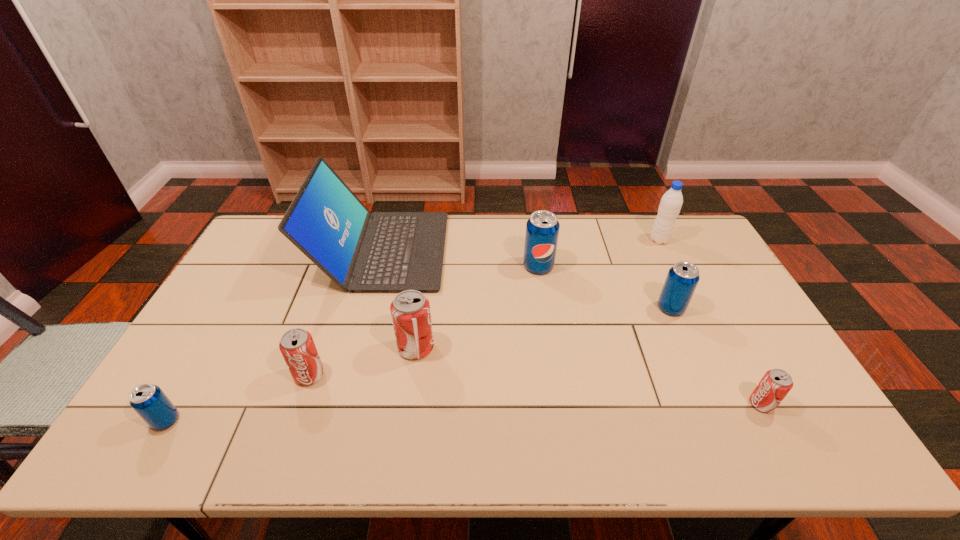
Where is `pink soda can that is the third closest to the leftmost soda can`? The image size is (960, 540). pink soda can that is the third closest to the leftmost soda can is located at coordinates (776, 383).

You are a GUI agent. You are given a task and a screenshot of the screen. Output one action in this format:
    pyautogui.click(x=<x>, y=<y>)
    Task: Click on the third closest pink soda can to the gray laptop computer
    Image resolution: width=960 pixels, height=540 pixels.
    Given the screenshot: What is the action you would take?
    pyautogui.click(x=776, y=383)

At what (x,y) coordinates should I click in order to perform the action: click on free region that satisfies the following two spatial constraints: 1. on the front side of the second smallest pink soda can; 2. on the right side of the nearest pink soda can. Please return your answer as a coordinate pair (x, y). This screenshot has height=540, width=960. Looking at the image, I should click on (300, 404).

You are a GUI agent. You are given a task and a screenshot of the screen. Output one action in this format:
    pyautogui.click(x=<x>, y=<y>)
    Task: Click on the vacant space that satisfies the following two spatial constraints: 1. on the screen of the gray laptop computer; 2. on the right side of the rightmost pink soda can
    The height and width of the screenshot is (540, 960).
    Given the screenshot: What is the action you would take?
    pyautogui.click(x=341, y=404)

This screenshot has width=960, height=540. Identify the location of free space that satisfies the following two spatial constraints: 1. on the back side of the second blue pop soda from right to left; 2. on the right side of the gray water bottle. [x=535, y=240].

Find the location of `free space that satisfies the following two spatial constraints: 1. on the screen of the laptop computer; 2. on the left side of the biggest pink soda can`. free space that satisfies the following two spatial constraints: 1. on the screen of the laptop computer; 2. on the left side of the biggest pink soda can is located at coordinates (356, 348).

At what (x,y) coordinates should I click in order to perform the action: click on free space in the image that satisfies the following two spatial constraints: 1. on the back side of the second pink soda can from left to right; 2. on the left side of the fifth object from left to right. Please return your answer as a coordinate pair (x, y). This screenshot has width=960, height=540. Looking at the image, I should click on (427, 266).

Identify the location of vacant space that satisfies the following two spatial constraints: 1. on the screen of the laptop computer; 2. on the left side of the nearest pink soda can. (341, 404).